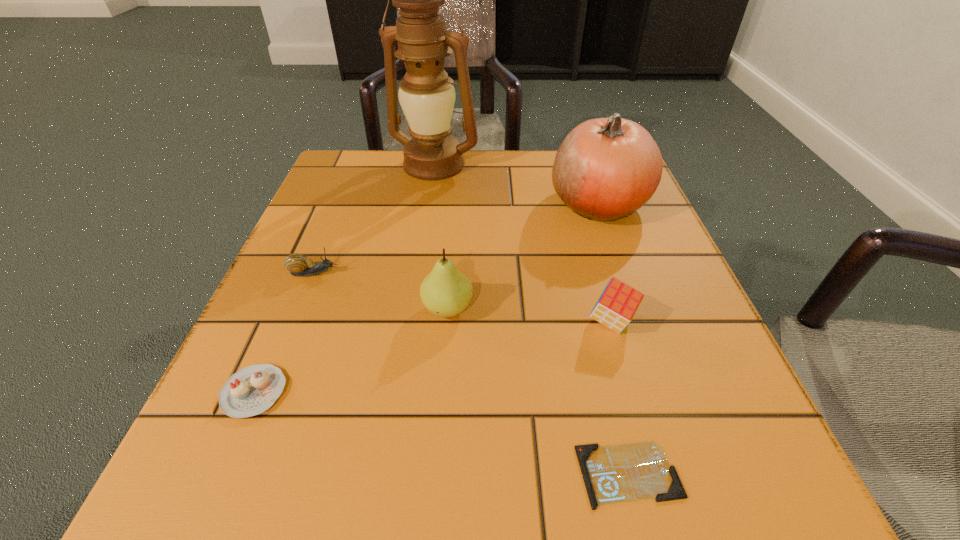
Locate an element on the screen. This screenshot has width=960, height=540. the tallest object is located at coordinates (x=426, y=94).

Locate an element on the screen. the sixth shortest object is located at coordinates (606, 168).

Locate an element on the screen. pear is located at coordinates (445, 291).

Locate an element on the screen. The image size is (960, 540). the fourth tallest object is located at coordinates (618, 303).

At what (x,y) coordinates should I click in order to perform the action: click on escargot. Please return your answer as a coordinate pair (x, y). This screenshot has height=540, width=960. Looking at the image, I should click on (299, 265).

I want to click on the third farthest object, so click(299, 265).

At what (x,y) coordinates should I click in order to perform the action: click on the second shortest object. Please return your answer as a coordinate pair (x, y). This screenshot has width=960, height=540. Looking at the image, I should click on (252, 390).

Where is `the sixth farthest object`? Image resolution: width=960 pixels, height=540 pixels. the sixth farthest object is located at coordinates (252, 390).

Locate an element on the screen. This screenshot has height=540, width=960. the shortest object is located at coordinates (620, 473).

The width and height of the screenshot is (960, 540). Identify the location of the nearest object. (620, 473).